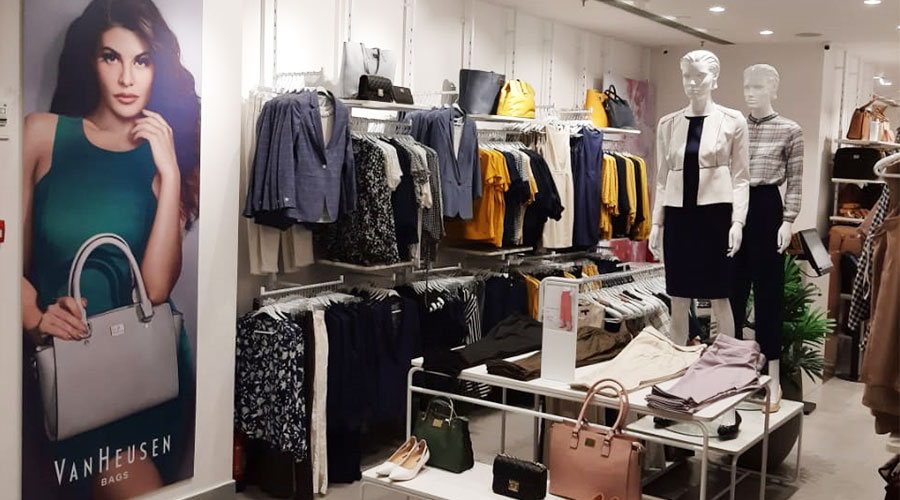
The image size is (900, 500). I want to click on floor, so click(x=848, y=462).